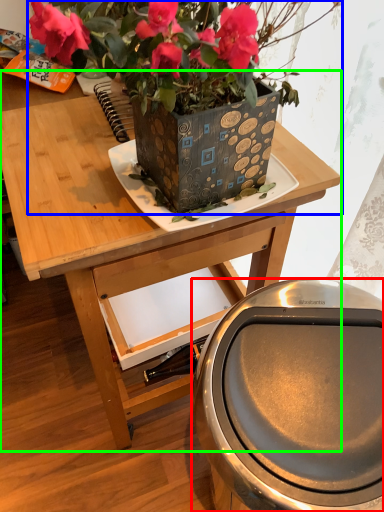
Question: Which object is positioned farthest from potty (highlighted by a red box)? Select from houseplant (highlighted by a blue box) and table (highlighted by a green box).

Choices:
 (A) houseplant
 (B) table

Answer: (A)